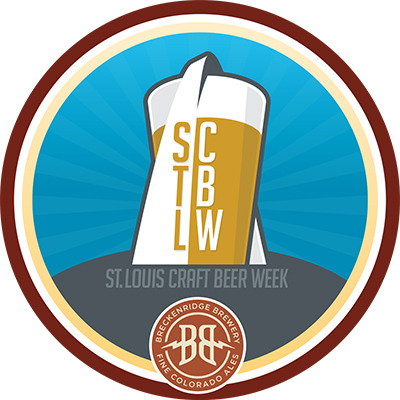
Locate an element on the screen. Image resolution: width=400 pixels, height=400 pixels. sticker is located at coordinates [x=206, y=329].